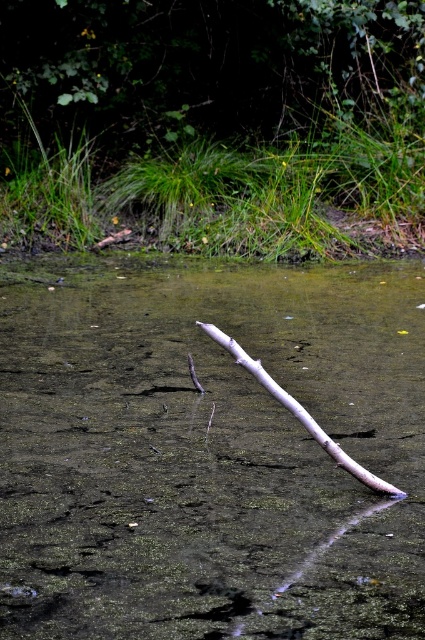
Question: Is clear water at center further to camera compared to smooth gray stick at center?

Choices:
 (A) no
 (B) yes

Answer: (A)

Question: Can you confirm if clear water at center is positioned above smooth gray stick at center?

Choices:
 (A) yes
 (B) no

Answer: (A)

Question: Which point is farther to the camera?

Choices:
 (A) (331, 451)
 (B) (127, 611)

Answer: (A)

Question: Is clear water at center thinner than smooth gray stick at center?

Choices:
 (A) yes
 (B) no

Answer: (B)